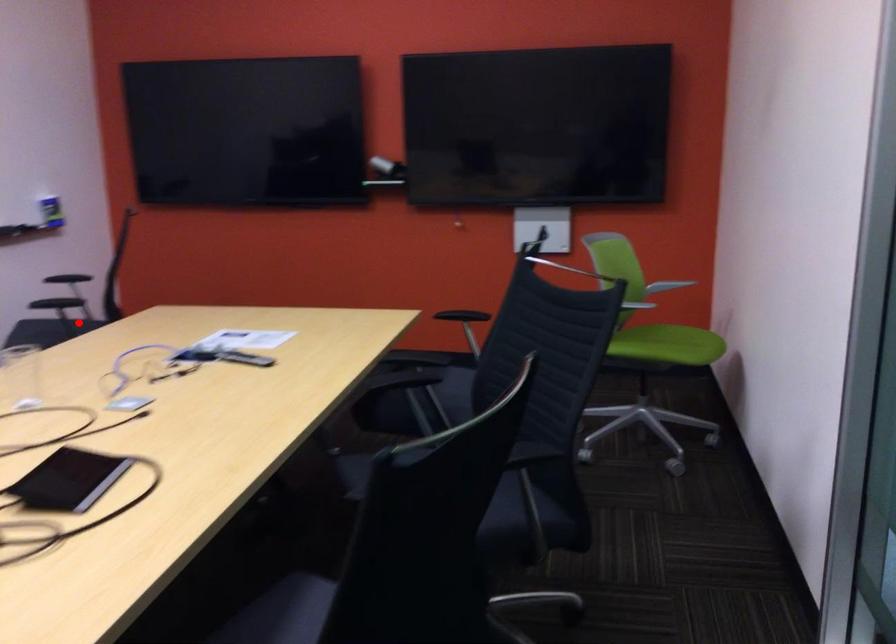
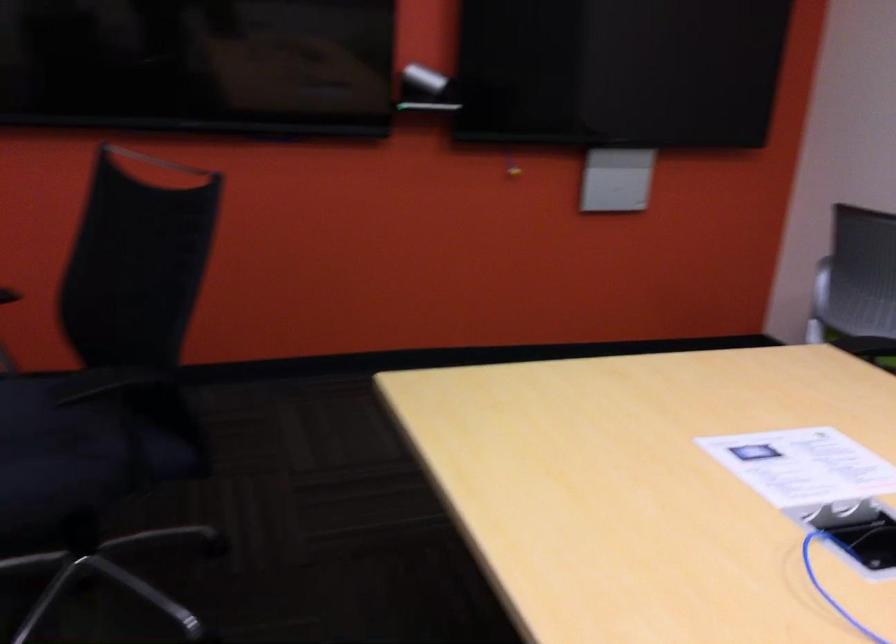
Question: I am providing you with two images of the same scene from different viewpoints. Given a red point in image1, look at the same physical point in image2. Is it:

Choices:
 (A) Closer to the viewpoint
 (B) Farther from the viewpoint

Answer: (A)